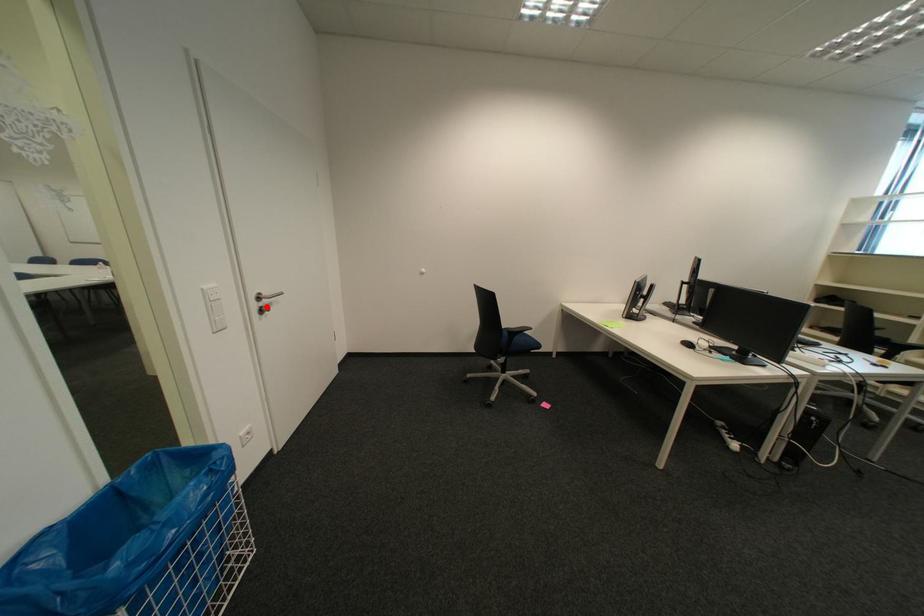
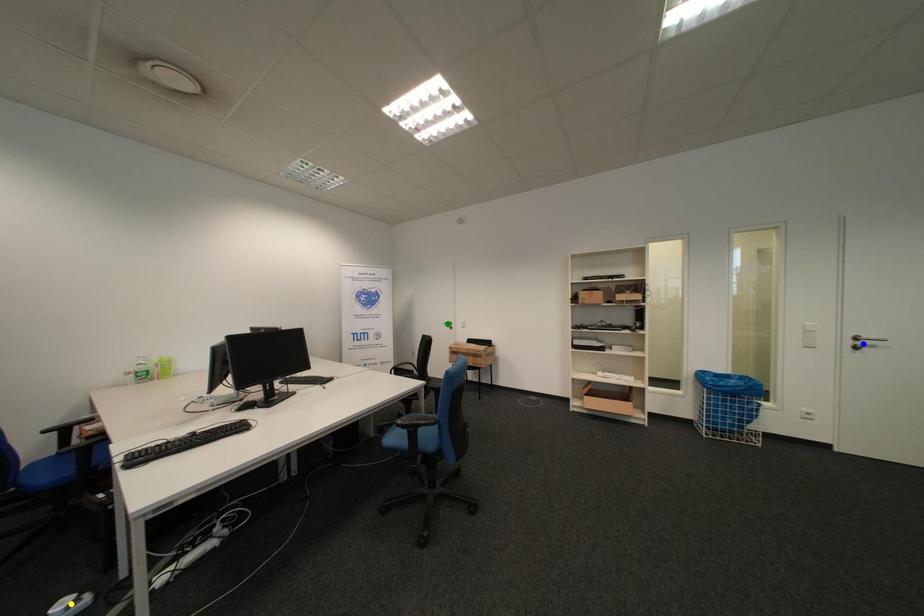
Question: I am providing you with two images of the same scene from different viewpoints. A red point is marked on the first image. You are given multiple points on the second image. Which point in image 2 is actually the same real-world point as the red point in image 1?

Choices:
 (A) yellow point
 (B) blue point
 (C) green point

Answer: (B)